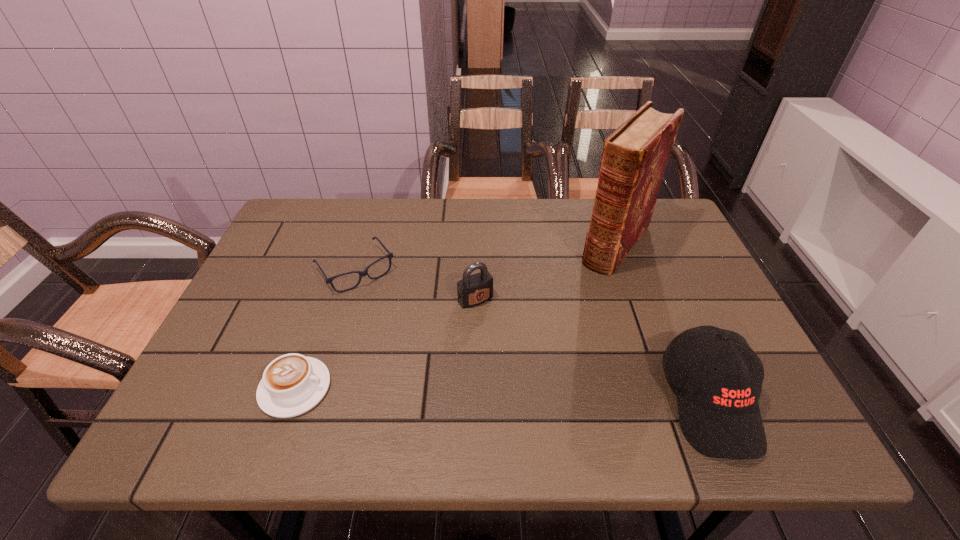
Identify the location of free space at the near left corner. (233, 367).

Locate an element on the screen. The image size is (960, 540). vacant region between the baseball cap and the cappuccino is located at coordinates (503, 394).

Locate an element on the screen. blank region between the spectacles and the cappuccino is located at coordinates (325, 329).

Locate an element on the screen. The width and height of the screenshot is (960, 540). vacant space in between the hardback book and the baseball cap is located at coordinates (663, 322).

Locate an element on the screen. The image size is (960, 540). free point between the third object from left to right and the hardback book is located at coordinates (546, 272).

You are a GUI agent. You are given a task and a screenshot of the screen. Output one action in this format:
    pyautogui.click(x=<x>, y=<y>)
    Task: Click on the vacant space that is in between the tallest object and the spectacles
    The width and height of the screenshot is (960, 540).
    Given the screenshot: What is the action you would take?
    pyautogui.click(x=486, y=256)

Find the location of a particular element. The image size is (960, 540). empty location between the spectacles and the baseball cap is located at coordinates (533, 335).

Identify the location of free point between the hardback book and the baseball cap. (663, 322).

Where is `free space between the baseball cap and the spectacles`? Image resolution: width=960 pixels, height=540 pixels. free space between the baseball cap and the spectacles is located at coordinates (533, 335).

Find the location of a particular element. empty location between the hardback book and the spectacles is located at coordinates (486, 256).